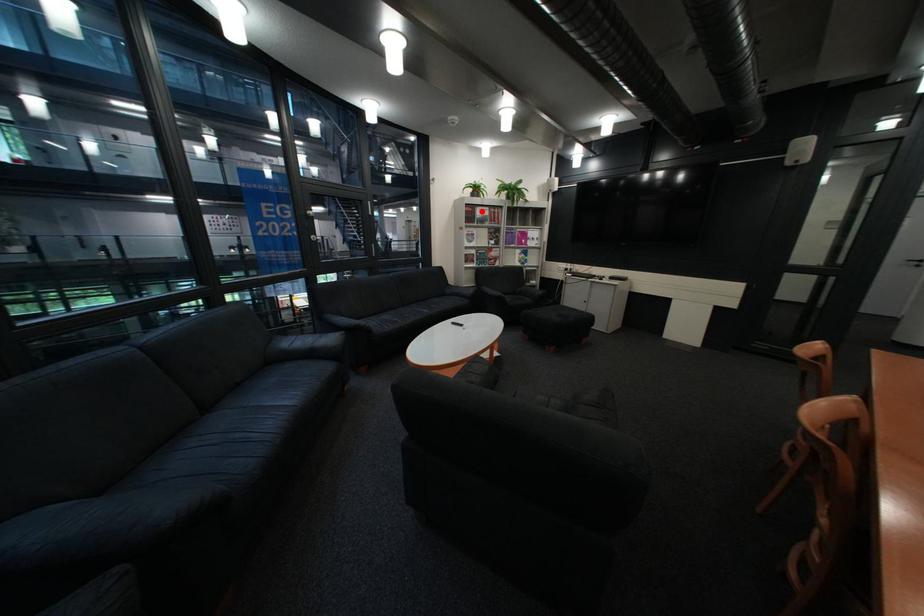
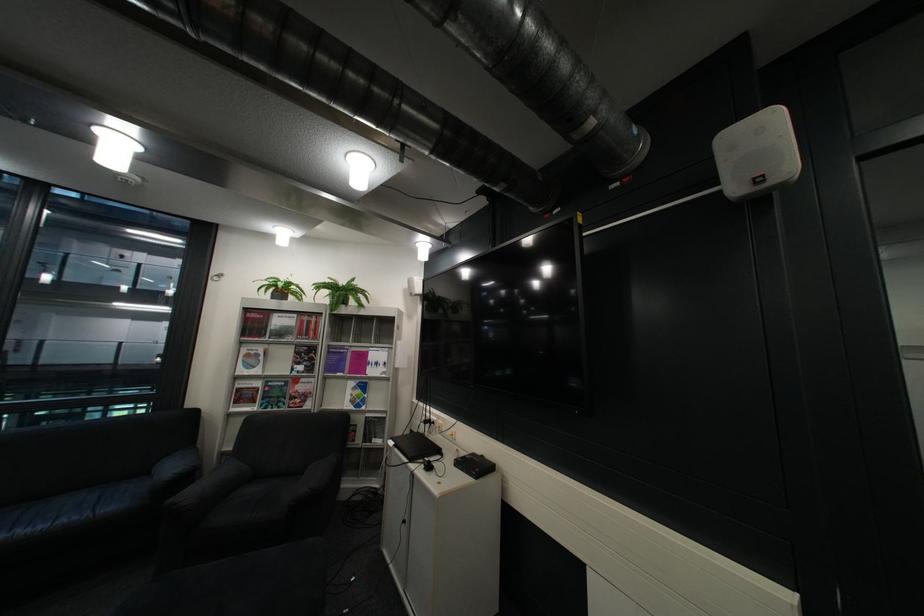
Find the pixel in the second image that matches the highlighted location in the first image.

(260, 320)